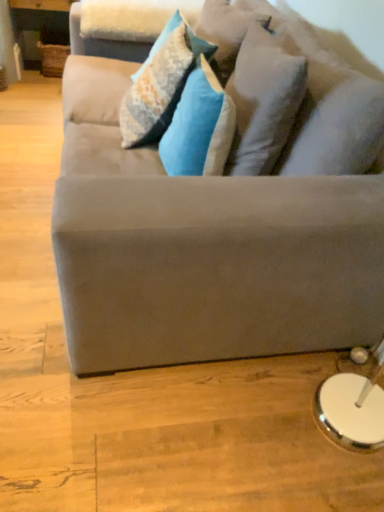
Describe the element at coordinates (160, 83) in the screenshot. I see `velvet blue pillow at center, positioned as the 3th pillow in right-to-left order` at that location.

What is the approximate height of suede gray couch at center?

The height of suede gray couch at center is 36.85 inches.

In order to face textured blue pillow at center, which is the 2th pillow from right to left, should I rotate leftwards or rightwards?

Turn right approximately 0.431 degrees to face it.

What do you see at coordinates (199, 127) in the screenshot? The image size is (384, 512). I see `textured blue pillow at center, which is the 2th pillow from right to left` at bounding box center [199, 127].

The image size is (384, 512). What are the coordinates of `white soft pillow at upper center, which is the 3th pillow in left-to-right order` in the screenshot? It's located at (263, 101).

Considering the sizes of objects textured blue pillow at center, which is counted as the 2th pillow, starting from the left, and velvet blue pillow at center, positioned as the 3th pillow in right-to-left order, in the image provided, who is shorter, textured blue pillow at center, which is counted as the 2th pillow, starting from the left, or velvet blue pillow at center, positioned as the 3th pillow in right-to-left order,?

Standing shorter between the two is textured blue pillow at center, which is counted as the 2th pillow, starting from the left.

From the image's perspective, is textured blue pillow at center, which is counted as the 2th pillow, starting from the left, above or below velvet blue pillow at center, positioned as the 3th pillow in right-to-left order?

Based on their image positions, textured blue pillow at center, which is counted as the 2th pillow, starting from the left, is located beneath velvet blue pillow at center, positioned as the 3th pillow in right-to-left order.

Is velvet blue pillow at center, positioned as the 3th pillow in right-to-left order, surrounded by textured blue pillow at center, which is the 2th pillow from right to left?

No, velvet blue pillow at center, positioned as the 3th pillow in right-to-left order, is located outside of textured blue pillow at center, which is the 2th pillow from right to left.

Considering their positions, is velvet blue pillow at center, which ranks as the first pillow in left-to-right order, located in front of or behind textured blue pillow at center, which is the 2th pillow from right to left?

Visually, velvet blue pillow at center, which ranks as the first pillow in left-to-right order, is located behind textured blue pillow at center, which is the 2th pillow from right to left.

Are velvet blue pillow at center, which ranks as the first pillow in left-to-right order, and textured blue pillow at center, which is the 2th pillow from right to left, beside each other?

There is a gap between velvet blue pillow at center, which ranks as the first pillow in left-to-right order, and textured blue pillow at center, which is the 2th pillow from right to left.

Is velvet blue pillow at center, positioned as the 3th pillow in right-to-left order, situated inside textured blue pillow at center, which is counted as the 2th pillow, starting from the left, or outside?

velvet blue pillow at center, positioned as the 3th pillow in right-to-left order, is not enclosed by textured blue pillow at center, which is counted as the 2th pillow, starting from the left.

Which of these two, white soft pillow at upper center, which is the first pillow from right to left, or suede gray couch at center, is bigger?

Bigger between the two is suede gray couch at center.

Which point is more distant from viewer, (229, 158) or (101, 310)?

The point (229, 158) is farther from the camera.

From the image's perspective, is white soft pillow at upper center, which is the 3th pillow in left-to-right order, above or below suede gray couch at center?

Based on their image positions, white soft pillow at upper center, which is the 3th pillow in left-to-right order, is located beneath suede gray couch at center.

Consider the image. Considering the positions of objects white soft pillow at upper center, which is the 3th pillow in left-to-right order, and suede gray couch at center in the image provided, who is in front, white soft pillow at upper center, which is the 3th pillow in left-to-right order, or suede gray couch at center?

suede gray couch at center.

Who is shorter, velvet blue pillow at center, positioned as the 3th pillow in right-to-left order, or suede gray couch at center?

Standing shorter between the two is velvet blue pillow at center, positioned as the 3th pillow in right-to-left order.

In the image, is velvet blue pillow at center, positioned as the 3th pillow in right-to-left order, on the left side or the right side of suede gray couch at center?

velvet blue pillow at center, positioned as the 3th pillow in right-to-left order, is to the left of suede gray couch at center.

Who is smaller, velvet blue pillow at center, positioned as the 3th pillow in right-to-left order, or suede gray couch at center?

Smaller between the two is velvet blue pillow at center, positioned as the 3th pillow in right-to-left order.

Looking at this image, is velvet blue pillow at center, positioned as the 3th pillow in right-to-left order, beside suede gray couch at center?

No, velvet blue pillow at center, positioned as the 3th pillow in right-to-left order, is not touching suede gray couch at center.

Is suede gray couch at center turned away from textured blue pillow at center, which is the 2th pillow from right to left?

Yes, textured blue pillow at center, which is the 2th pillow from right to left, is at the back of suede gray couch at center.

In the scene shown: Considering the relative sizes of suede gray couch at center and textured blue pillow at center, which is the 2th pillow from right to left, in the image provided, is suede gray couch at center thinner than textured blue pillow at center, which is the 2th pillow from right to left,?

In fact, suede gray couch at center might be wider than textured blue pillow at center, which is the 2th pillow from right to left.

Is point (132, 172) farther from camera compared to point (195, 130)?

Yes, it is.

Is suede gray couch at center at the left side of textured blue pillow at center, which is counted as the 2th pillow, starting from the left?

Yes.

Is white soft pillow at upper center, which is the first pillow from right to left, inside velvet blue pillow at center, which ranks as the first pillow in left-to-right order?

No, white soft pillow at upper center, which is the first pillow from right to left, is not inside velvet blue pillow at center, which ranks as the first pillow in left-to-right order.

Which of these two, velvet blue pillow at center, which ranks as the first pillow in left-to-right order, or white soft pillow at upper center, which is the first pillow from right to left, is bigger?

With larger size is velvet blue pillow at center, which ranks as the first pillow in left-to-right order.

Considering the positions of points (162, 121) and (283, 115), is point (162, 121) farther from camera compared to point (283, 115)?

That is True.

Is textured blue pillow at center, which is counted as the 2th pillow, starting from the left, aimed at suede gray couch at center?

Yes, textured blue pillow at center, which is counted as the 2th pillow, starting from the left, is turned towards suede gray couch at center.

Can you confirm if textured blue pillow at center, which is counted as the 2th pillow, starting from the left, is positioned to the right of suede gray couch at center?

Yes, textured blue pillow at center, which is counted as the 2th pillow, starting from the left, is to the right of suede gray couch at center.

Consider the image. Is the depth of textured blue pillow at center, which is the 2th pillow from right to left, less than that of suede gray couch at center?

No, textured blue pillow at center, which is the 2th pillow from right to left, is behind suede gray couch at center.

What's the angular difference between textured blue pillow at center, which is the 2th pillow from right to left, and suede gray couch at center's facing directions?

There is a 2.06-degree angle between the facing directions of textured blue pillow at center, which is the 2th pillow from right to left, and suede gray couch at center.

Where is `pillow below the velvet blue pillow at center, positioned as the 3th pillow in right-to-left order (from a real-world perspective)`? The image size is (384, 512). pillow below the velvet blue pillow at center, positioned as the 3th pillow in right-to-left order (from a real-world perspective) is located at coordinates (199, 127).

Locate an element on the screen. The width and height of the screenshot is (384, 512). the 1st pillow counting from the right of the velvet blue pillow at center, positioned as the 3th pillow in right-to-left order is located at coordinates (199, 127).

Looking at the image, which one is located closer to textured blue pillow at center, which is the 2th pillow from right to left, suede gray couch at center or white soft pillow at upper center, which is the 3th pillow in left-to-right order?

Based on the image, white soft pillow at upper center, which is the 3th pillow in left-to-right order, appears to be nearer to textured blue pillow at center, which is the 2th pillow from right to left.

Estimate the real-world distances between objects in this image. Which object is closer to white soft pillow at upper center, which is the 3th pillow in left-to-right order, textured blue pillow at center, which is the 2th pillow from right to left, or velvet blue pillow at center, which ranks as the first pillow in left-to-right order?

textured blue pillow at center, which is the 2th pillow from right to left, is positioned closer to the anchor white soft pillow at upper center, which is the 3th pillow in left-to-right order.

When comparing their distances from white soft pillow at upper center, which is the 3th pillow in left-to-right order, does textured blue pillow at center, which is counted as the 2th pillow, starting from the left, or suede gray couch at center seem further?

suede gray couch at center is further to white soft pillow at upper center, which is the 3th pillow in left-to-right order.

Based on their spatial positions, is textured blue pillow at center, which is the 2th pillow from right to left, or velvet blue pillow at center, positioned as the 3th pillow in right-to-left order, closer to suede gray couch at center?

textured blue pillow at center, which is the 2th pillow from right to left.

Which object lies nearer to the anchor point velvet blue pillow at center, positioned as the 3th pillow in right-to-left order, textured blue pillow at center, which is the 2th pillow from right to left, or white soft pillow at upper center, which is the first pillow from right to left?

Based on the image, textured blue pillow at center, which is the 2th pillow from right to left, appears to be nearer to velvet blue pillow at center, positioned as the 3th pillow in right-to-left order.

Based on the photo, which object lies nearer to the anchor point velvet blue pillow at center, positioned as the 3th pillow in right-to-left order, suede gray couch at center or white soft pillow at upper center, which is the first pillow from right to left?

white soft pillow at upper center, which is the first pillow from right to left, is closer to velvet blue pillow at center, positioned as the 3th pillow in right-to-left order.

Estimate the real-world distances between objects in this image. Which object is closer to velvet blue pillow at center, positioned as the 3th pillow in right-to-left order, white soft pillow at upper center, which is the 3th pillow in left-to-right order, or textured blue pillow at center, which is counted as the 2th pillow, starting from the left?

Among the two, textured blue pillow at center, which is counted as the 2th pillow, starting from the left, is located nearer to velvet blue pillow at center, positioned as the 3th pillow in right-to-left order.

From the image, which object appears to be nearer to white soft pillow at upper center, which is the first pillow from right to left, velvet blue pillow at center, which ranks as the first pillow in left-to-right order, or textured blue pillow at center, which is the 2th pillow from right to left?

textured blue pillow at center, which is the 2th pillow from right to left, lies closer to white soft pillow at upper center, which is the first pillow from right to left, than the other object.

The height and width of the screenshot is (512, 384). I want to click on pillow located between velvet blue pillow at center, which ranks as the first pillow in left-to-right order, and white soft pillow at upper center, which is the first pillow from right to left, in the left-right direction, so click(199, 127).

Locate an element on the screen. pillow positioned between suede gray couch at center and textured blue pillow at center, which is the 2th pillow from right to left, from near to far is located at coordinates (263, 101).